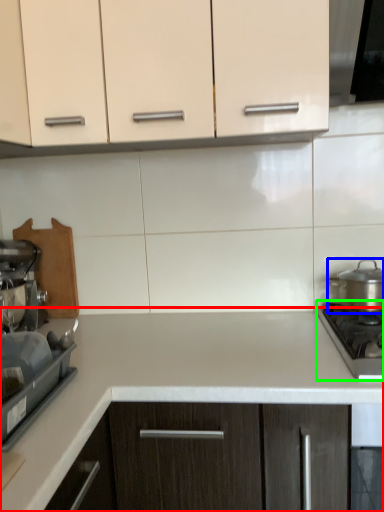
Question: Considering the real-world distances, which object is closest to countertop (highlighted by a red box)? kitchen appliance (highlighted by a blue box) or gas stove (highlighted by a green box).

Choices:
 (A) kitchen appliance
 (B) gas stove

Answer: (B)